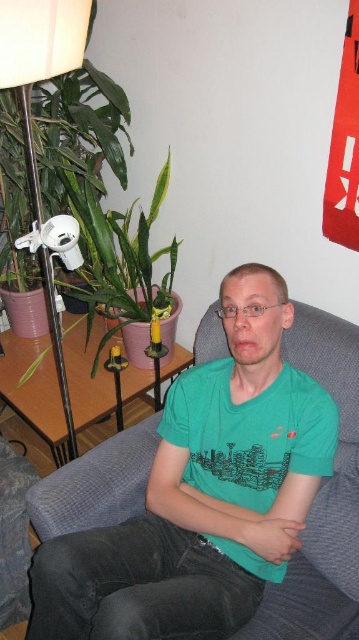
Is green cotton t-shirt at center closer to the viewer compared to green leafy plant at left?

Yes.

Is point (266, 461) closer to camera compared to point (11, 58)?

That is False.

Does point (285, 404) come behind point (19, 8)?

That is True.

Find the location of a particular element. The width and height of the screenshot is (359, 640). green cotton t-shirt at center is located at coordinates (202, 493).

Who is more forward, [90,228] or [10,451]?

Point [10,451] is in front.

Is green leafy plant at left above fuzzy fabric couch at lower left?

Yes.

Identify the location of green leafy plant at left. This screenshot has height=640, width=359. (39, 65).

From the picture: Is green cotton t-shirt at center smaller than fuzzy fabric couch at lower left?

No, green cotton t-shirt at center is not smaller than fuzzy fabric couch at lower left.

Between green cotton t-shirt at center and fuzzy fabric couch at lower left, which one has less height?

A: fuzzy fabric couch at lower left is shorter.

Which is behind, point (211, 451) or point (33, 470)?

The point (33, 470) is behind.

In order to click on green cotton t-shirt at center in this screenshot , I will do `click(202, 493)`.